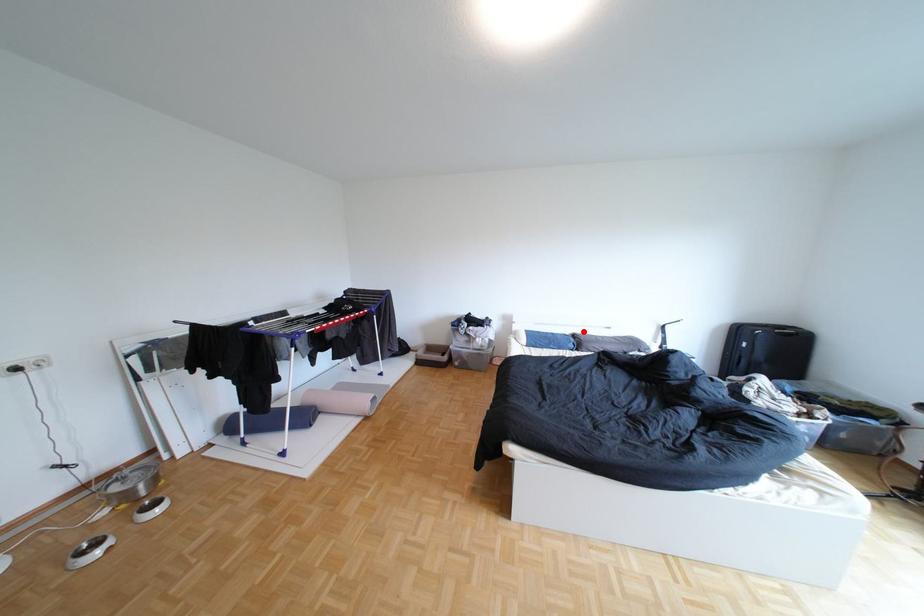
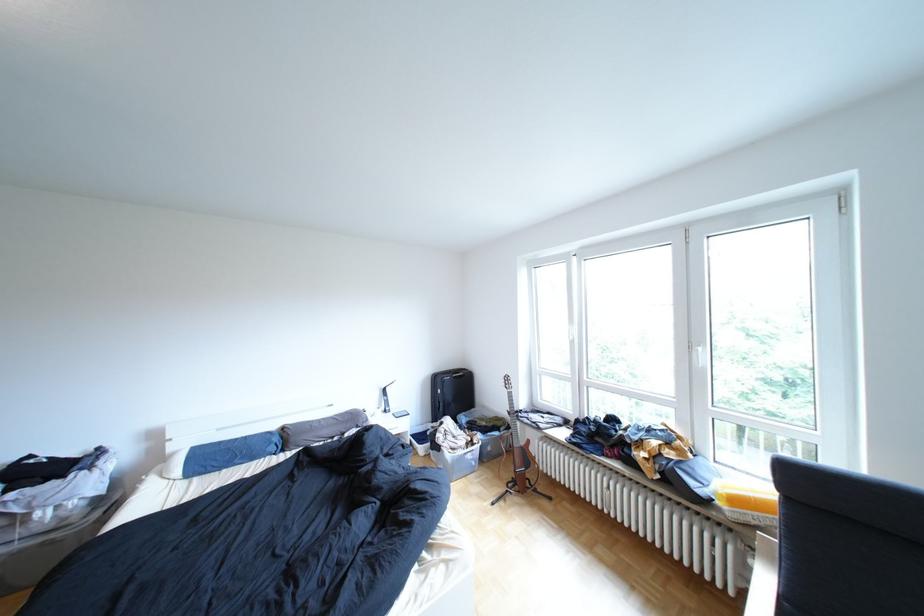
The point at the highlighted location is marked in the first image. Where is the corresponding point in the second image?

(289, 427)